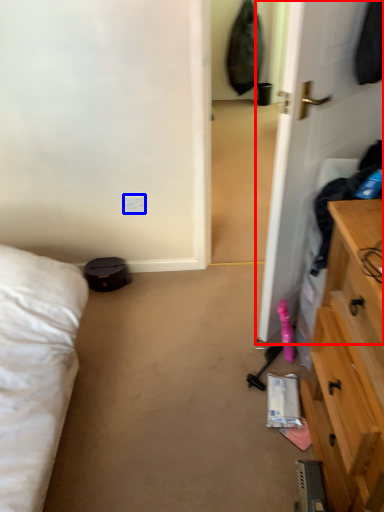
Question: Which of the following is the farthest to the observer, door (highlighted by a red box) or electric outlet (highlighted by a blue box)?

Choices:
 (A) door
 (B) electric outlet

Answer: (B)